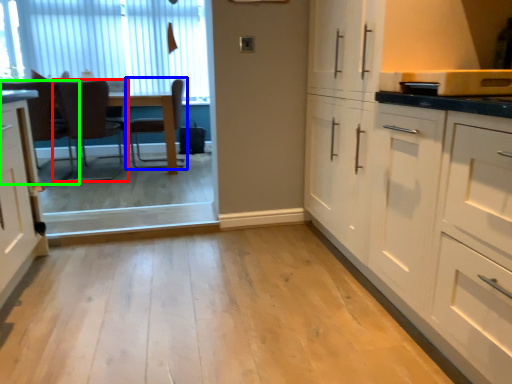
Question: Estimate the real-world distances between objects in this image. Which object is closer to chair (highlighted by a red box), chair (highlighted by a blue box) or chair (highlighted by a green box)?

Choices:
 (A) chair
 (B) chair

Answer: (B)